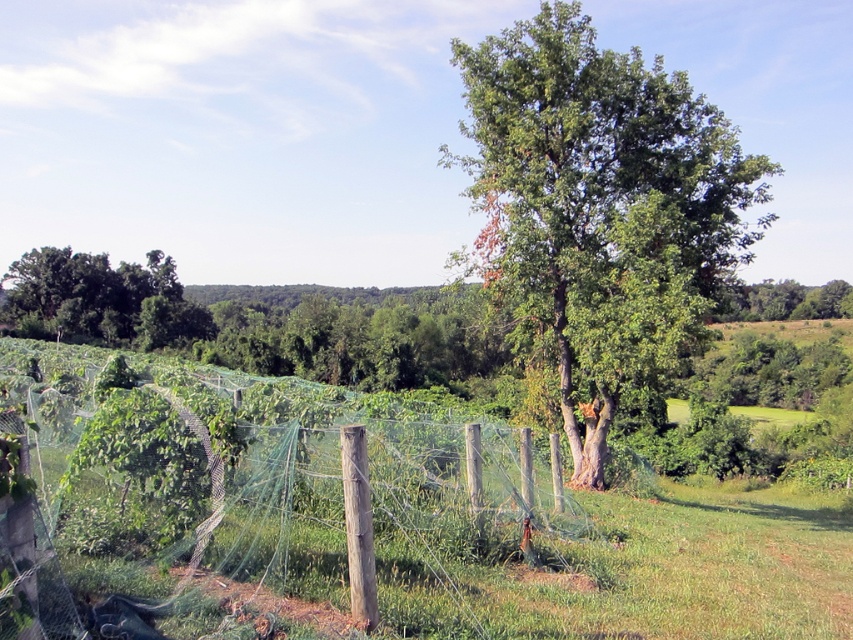
Question: Can you confirm if green mesh net at center is positioned to the left of green leafy tree at center?

Choices:
 (A) no
 (B) yes

Answer: (B)

Question: Does green leafy tree at center have a lesser width compared to green leafy tree at left?

Choices:
 (A) no
 (B) yes

Answer: (B)

Question: Which point is farther to the camera?

Choices:
 (A) green leafy tree at left
 (B) green mesh net at center
 (C) green leafy tree at center

Answer: (A)

Question: Which point is farther to the camera?

Choices:
 (A) (109, 637)
 (B) (585, 451)
 (C) (119, 337)

Answer: (C)

Question: Can you confirm if green mesh net at center is positioned above green leafy tree at center?

Choices:
 (A) no
 (B) yes

Answer: (A)

Question: Which object is farther from the camera taking this photo?

Choices:
 (A) green leafy tree at left
 (B) green leafy tree at center

Answer: (A)